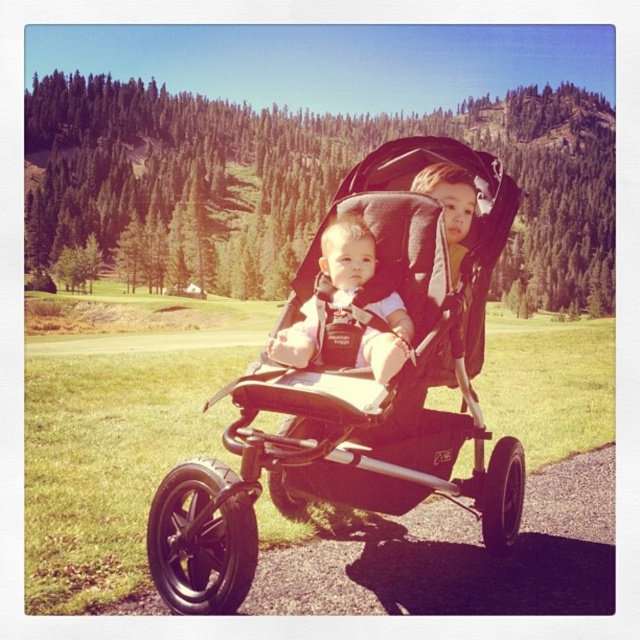
Is green grass at center above matte black baby at center?

Actually, green grass at center is below matte black baby at center.

Is green grass at center smaller than matte black baby at center?

Incorrect, green grass at center is not smaller in size than matte black baby at center.

Find the location of `green grass at center`. green grass at center is located at coordinates (116, 445).

Can you confirm if black fabric stroller at center is positioned to the left of matte black baby at center?

No, black fabric stroller at center is not to the left of matte black baby at center.

This screenshot has height=640, width=640. I want to click on black fabric stroller at center, so click(356, 394).

Does black fabric stroller at center appear on the left side of green grass at center?

Indeed, black fabric stroller at center is positioned on the left side of green grass at center.

Is point (204, 477) positioned after point (49, 374)?

That is False.

This screenshot has width=640, height=640. In order to click on black fabric stroller at center in this screenshot , I will do `click(356, 394)`.